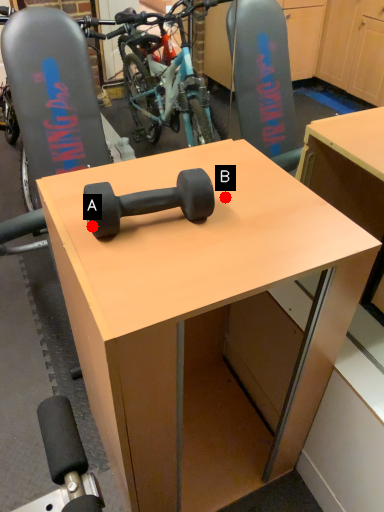
Question: Two points are circled on the image, labeled by A and B beside each circle. Which point is closer to the camera taking this photo?

Choices:
 (A) A is closer
 (B) B is closer

Answer: (A)